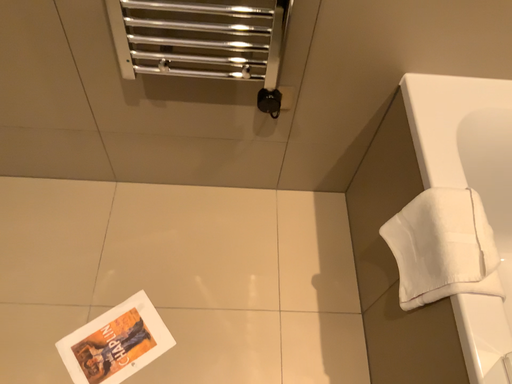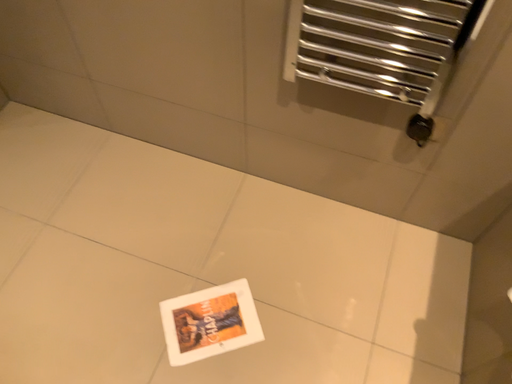
Question: Which way did the camera rotate in the video?

Choices:
 (A) rotated right
 (B) rotated left

Answer: (B)